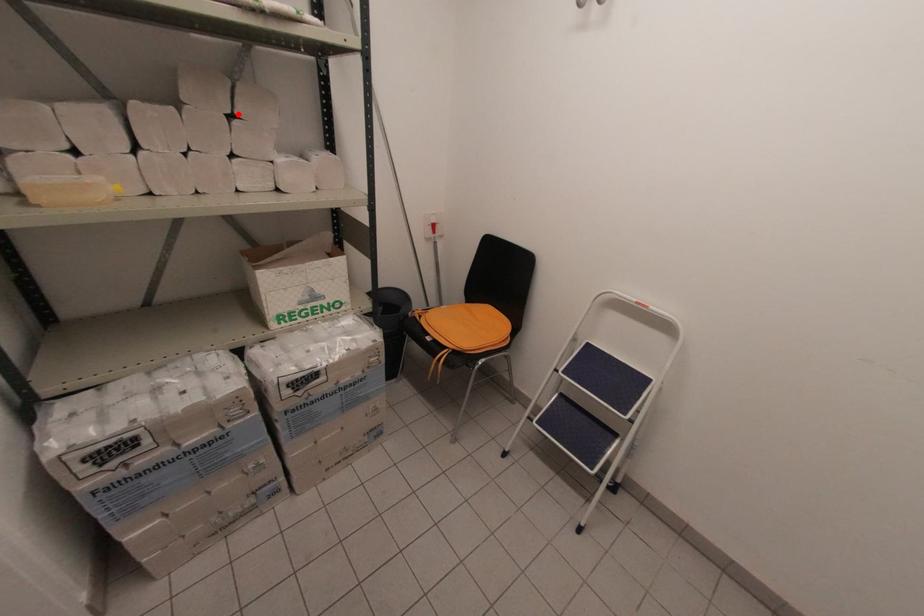
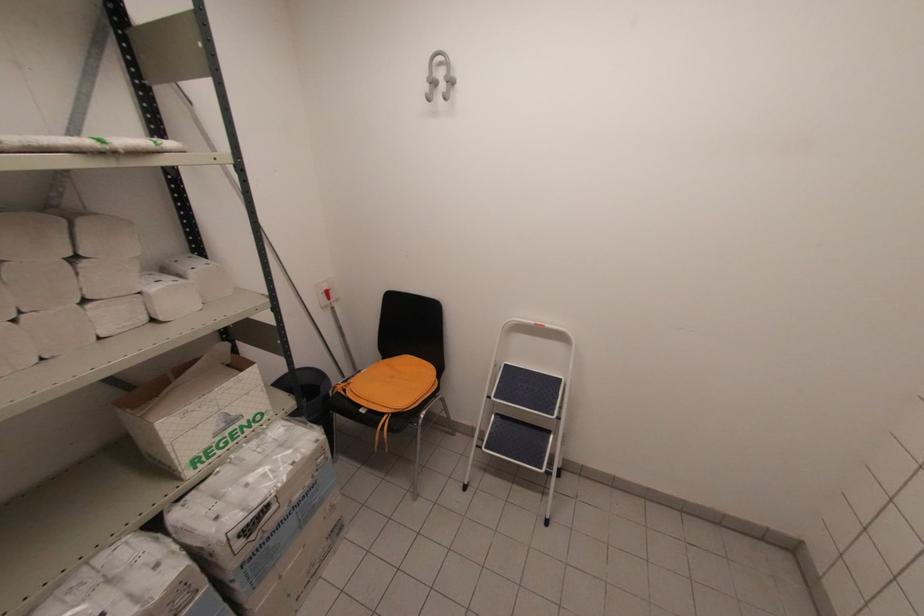
Find the pixel in the second image that matches the highlighted location in the first image.

(81, 254)